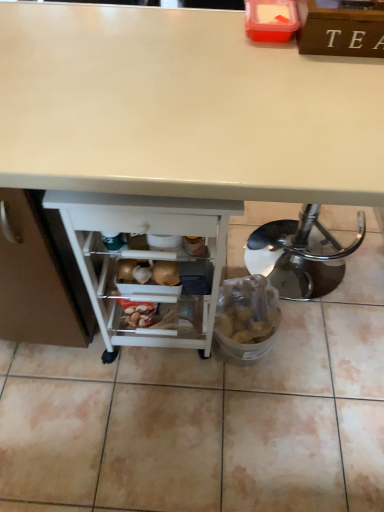
Question: In the image, is white glossy desk at center positioned in front of or behind white plastic shelf at lower center?

Choices:
 (A) behind
 (B) front

Answer: (B)

Question: From the image's perspective, is white glossy desk at center positioned above or below white plastic shelf at lower center?

Choices:
 (A) below
 (B) above

Answer: (B)

Question: Looking at their shapes, would you say white glossy desk at center is wider or thinner than white plastic shelf at lower center?

Choices:
 (A) thin
 (B) wide

Answer: (B)

Question: Does point (84, 222) appear closer or farther from the camera than point (178, 194)?

Choices:
 (A) farther
 (B) closer

Answer: (A)

Question: Is white plastic shelf at lower center in front of or behind white glossy desk at center in the image?

Choices:
 (A) behind
 (B) front

Answer: (A)

Question: Is white plastic shelf at lower center wider or thinner than white glossy desk at center?

Choices:
 (A) thin
 (B) wide

Answer: (A)

Question: From a real-world perspective, is white plastic shelf at lower center positioned above or below white glossy desk at center?

Choices:
 (A) below
 (B) above

Answer: (A)